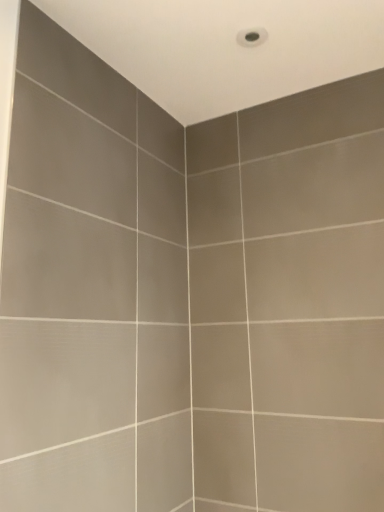
What are the coordinates of `white glossy showerhead at upper center` in the screenshot? It's located at (252, 37).

What do you see at coordinates (252, 37) in the screenshot? This screenshot has height=512, width=384. I see `white glossy showerhead at upper center` at bounding box center [252, 37].

What are the coordinates of `white glossy showerhead at upper center` in the screenshot? It's located at (252, 37).